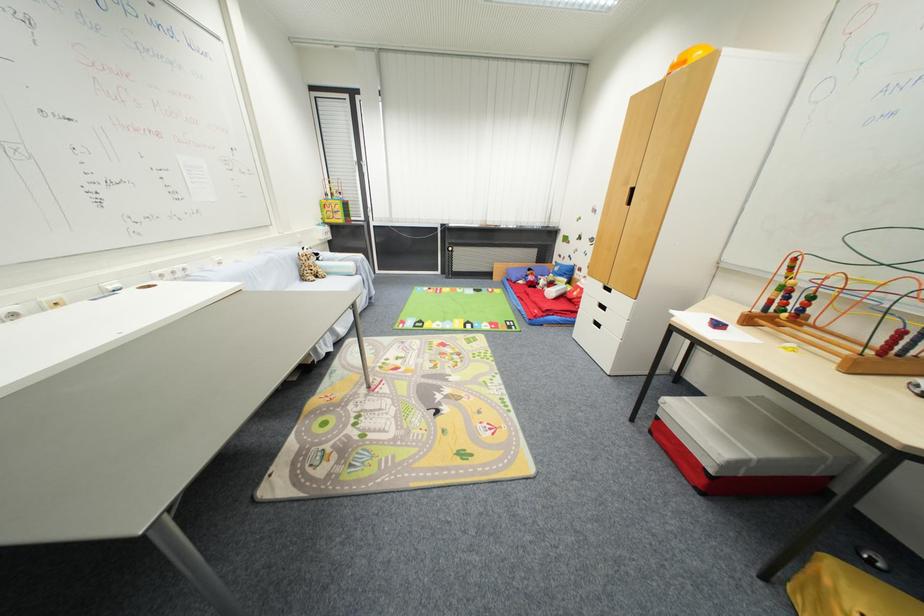
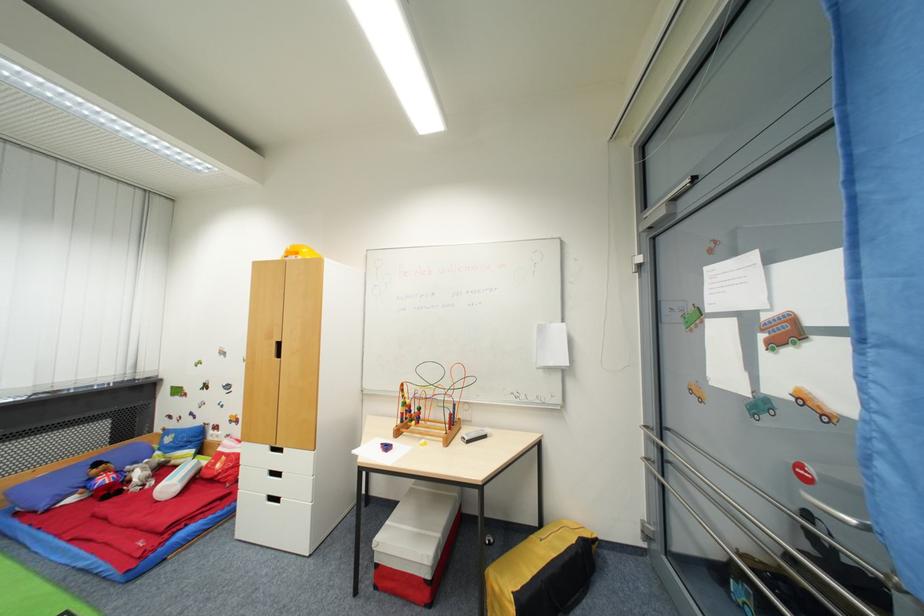
Question: The camera is either moving clockwise (left) or counter-clockwise (right) around the object. The first image is from the beginning of the video and the second image is from the end. Is the camera moving left or right when shooting the video?

Choices:
 (A) Left
 (B) Right

Answer: (A)